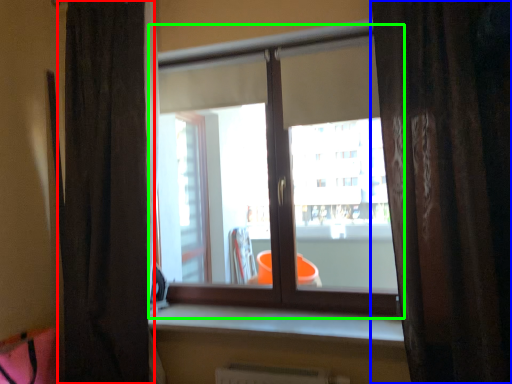
Question: Considering the real-world distances, which object is closest to curtain (highlighted by a red box)? curtain (highlighted by a blue box) or window (highlighted by a green box).

Choices:
 (A) curtain
 (B) window

Answer: (B)